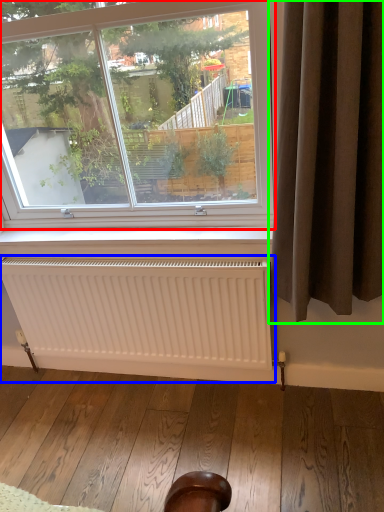
Question: Based on their relative distances, which object is nearer to window (highlighted by a red box)? Choose from radiator (highlighted by a blue box) and curtain (highlighted by a green box).

Choices:
 (A) radiator
 (B) curtain

Answer: (B)